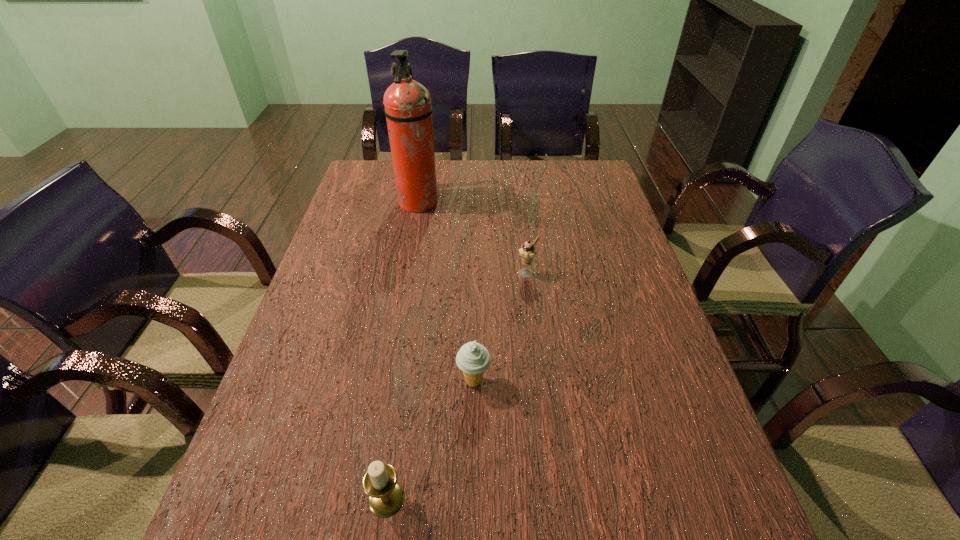
At what (x,y) coordinates should I click in order to perform the action: click on free space that satisfies the following two spatial constraints: 1. on the back side of the farther icecream; 2. on the right side of the nearest object. Please return your answer as a coordinate pair (x, y). Image resolution: width=960 pixels, height=540 pixels. Looking at the image, I should click on (420, 273).

The height and width of the screenshot is (540, 960). In order to click on vacant space that satisfies the following two spatial constraints: 1. at the nozzle of the rightmost object; 2. on the left side of the tallest object in this screenshot , I will do `click(405, 273)`.

Locate an element on the screen. This screenshot has height=540, width=960. free space that satisfies the following two spatial constraints: 1. at the nozzle of the nearest object; 2. on the left side of the tallest object is located at coordinates (364, 498).

Find the location of a particular element. Image resolution: width=960 pixels, height=540 pixels. vacant area in the image that satisfies the following two spatial constraints: 1. at the nozzle of the third nearest object; 2. on the left side of the fire extinguisher is located at coordinates (405, 273).

At what (x,y) coordinates should I click in order to perform the action: click on vacant point that satisfies the following two spatial constraints: 1. on the back side of the candle holder; 2. at the nozzle of the farthest object. Please return your answer as a coordinate pair (x, y). Looking at the image, I should click on (430, 203).

Locate an element on the screen. free spot that satisfies the following two spatial constraints: 1. at the nozzle of the second farthest object; 2. on the right side of the tallest object is located at coordinates pyautogui.click(x=405, y=273).

Locate an element on the screen. vacant space that satisfies the following two spatial constraints: 1. at the nozzle of the tallest object; 2. on the left side of the candle holder is located at coordinates [364, 498].

Identify the location of free spot that satisfies the following two spatial constraints: 1. at the nozzle of the third farthest object; 2. on the left side of the tallest object. The image size is (960, 540). (385, 381).